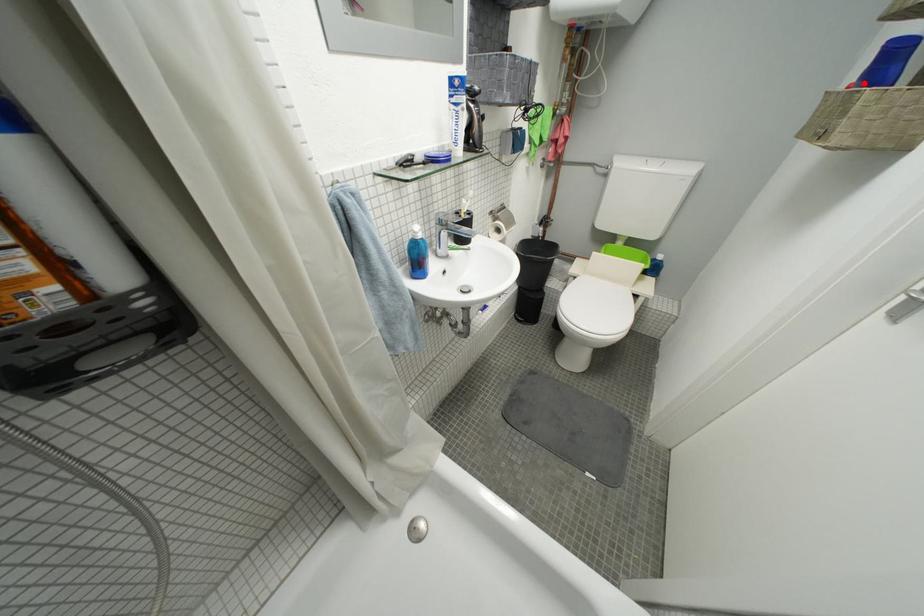
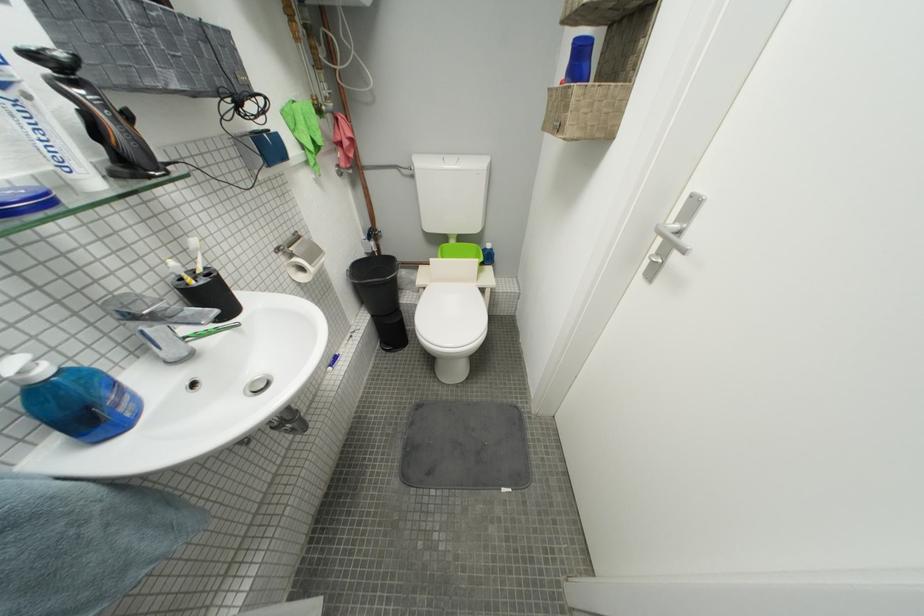
Question: I am providing you with two images of the same scene from different viewpoints. A red point is shown in image1. For the corresponding object point in image2, is it positioned nearer or farther from the camera?

Choices:
 (A) Nearer
 (B) Farther

Answer: (A)